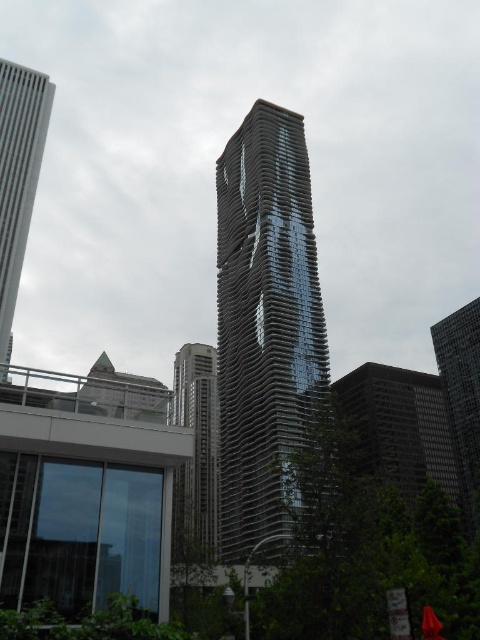
Question: Which object appears closest to the camera in this image?

Choices:
 (A) white glass skyscraper at left
 (B) metallic glass skyscraper at center
 (C) glossy glass tower at center
 (D) dark gray concrete building at center

Answer: (B)

Question: Which of the following is the farthest from the observer?

Choices:
 (A) (231, 349)
 (B) (214, 458)
 (C) (20, 115)
 (D) (360, 392)

Answer: (B)

Question: Is metallic glass skyscraper at center smaller than glassy reflective skyscraper at right?

Choices:
 (A) no
 (B) yes

Answer: (A)

Question: Considering the real-world distances, which object is farthest from the white glass skyscraper at left?

Choices:
 (A) glossy glass tower at center
 (B) dark gray concrete building at center
 (C) metallic glass skyscraper at center

Answer: (B)

Question: Is metallic glass skyscraper at center further to camera compared to glassy reflective skyscraper at right?

Choices:
 (A) yes
 (B) no

Answer: (B)

Question: Does dark gray concrete building at center have a larger size compared to metallic glass skyscraper at center?

Choices:
 (A) no
 (B) yes

Answer: (B)